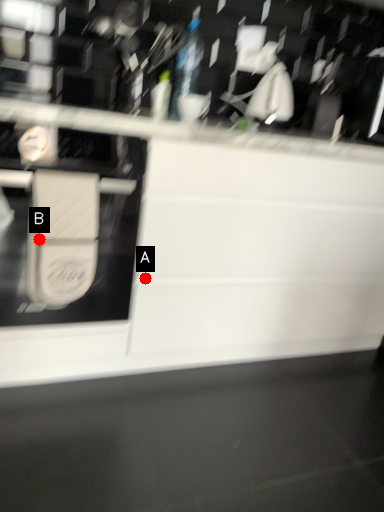
Question: Two points are circled on the image, labeled by A and B beside each circle. Which point is farther from the camera taking this photo?

Choices:
 (A) A is further
 (B) B is further

Answer: (A)